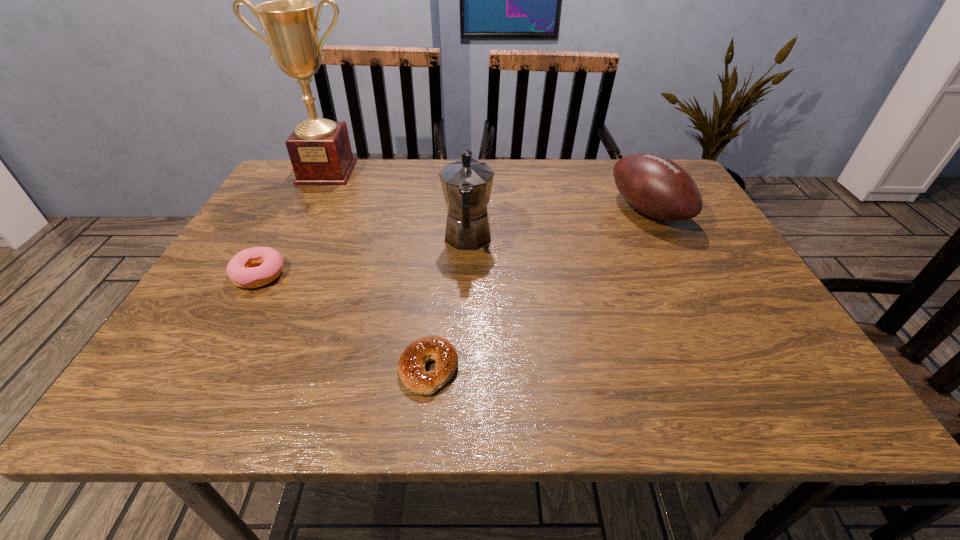
Locate an element on the screen. Image resolution: width=960 pixels, height=540 pixels. object positioned at the right edge is located at coordinates (655, 186).

At what (x,y) coordinates should I click in order to perform the action: click on object that is at the far left corner. Please return your answer as a coordinate pair (x, y). Looking at the image, I should click on (320, 151).

The height and width of the screenshot is (540, 960). Identify the location of object that is at the far right corner. (655, 186).

Identify the location of free space at the far edge. tap(444, 165).

Find the location of a particular element. free region at the left edge is located at coordinates 298,228.

At what (x,y) coordinates should I click in order to perform the action: click on vacant space at the right edge of the desktop. Please return your answer as a coordinate pair (x, y). This screenshot has width=960, height=540. Looking at the image, I should click on (715, 300).

I want to click on free space at the near left corner of the desktop, so click(x=183, y=375).

Identify the location of vacant space at the near right corner of the desktop. The width and height of the screenshot is (960, 540). (767, 372).

Identify the location of free space between the coffeepot and the farthest object. (397, 206).

At what (x,y) coordinates should I click in order to perform the action: click on blank region between the second shortest object and the nearest object. Please return your answer as a coordinate pair (x, y). Looking at the image, I should click on (344, 322).